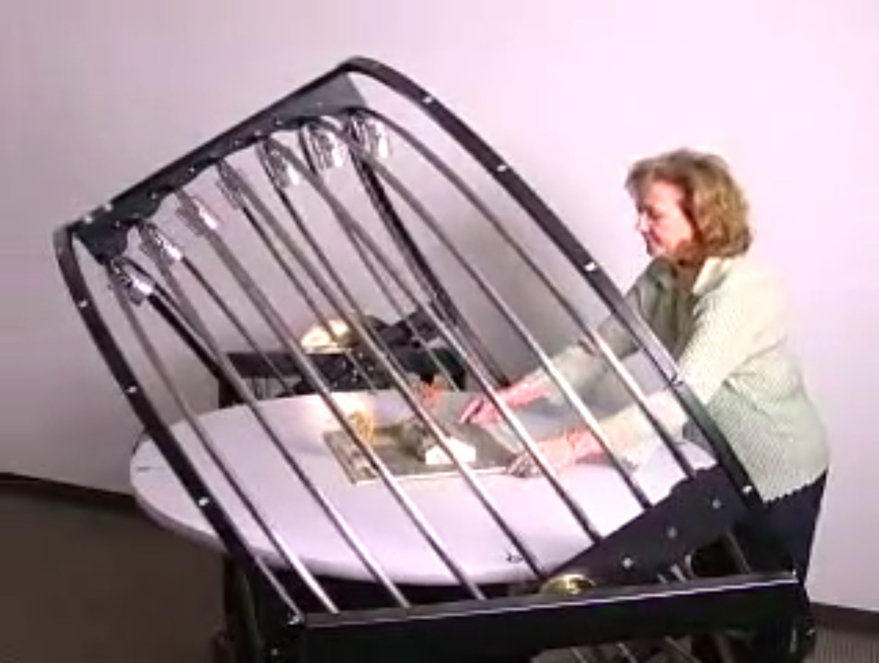
At what (x,y) coordinates should I click in order to perform the action: click on decor. Please return your answer as a coordinate pair (x, y). Image resolution: width=879 pixels, height=663 pixels. Looking at the image, I should click on (325, 394).